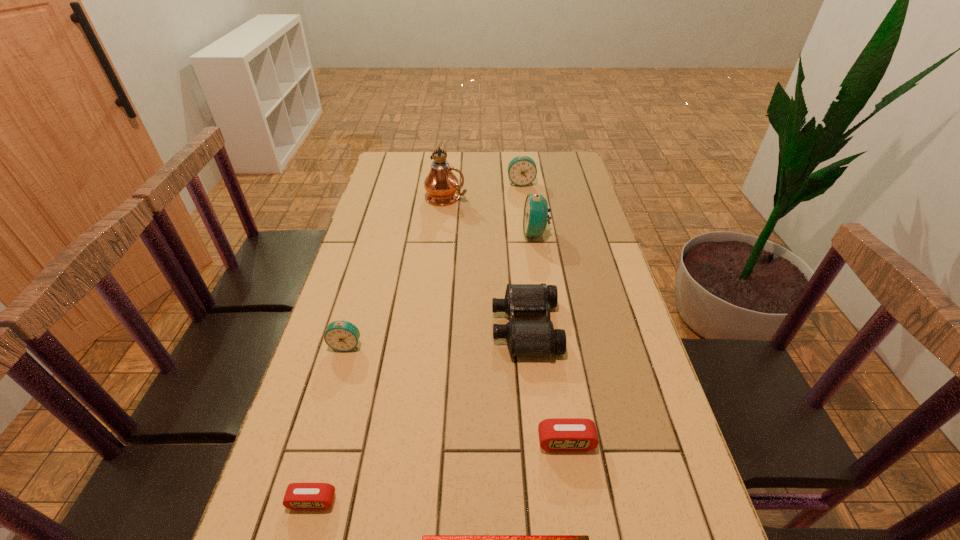
Where is `vacant area that lies between the seventh shortest object and the oil lamp`? This screenshot has width=960, height=540. vacant area that lies between the seventh shortest object and the oil lamp is located at coordinates (491, 215).

The width and height of the screenshot is (960, 540). In order to click on vacant space in between the third shortest alarm clock and the tallest object in this screenshot , I will do `click(396, 271)`.

Where is `free area in between the nearest blue alarm clock and the tallest object`? free area in between the nearest blue alarm clock and the tallest object is located at coordinates (396, 271).

Locate an element on the screen. This screenshot has height=540, width=960. free area in between the leftmost blue alarm clock and the right pink alarm clock is located at coordinates (456, 394).

Identify the location of object that stands as the fourth closest to the second farthest alarm clock. Image resolution: width=960 pixels, height=540 pixels. (340, 335).

Find the location of a particular element. The image size is (960, 540). the third closest object to the sixth farthest object is located at coordinates (299, 496).

At what (x,y) coordinates should I click in order to perform the action: click on the second closest alarm clock to the farthest alarm clock. Please return your answer as a coordinate pair (x, y). This screenshot has width=960, height=540. Looking at the image, I should click on (340, 335).

I want to click on alarm clock that is the nearest to the binoculars, so click(x=557, y=434).

Identify which blue alarm clock is located as the second nearest to the smallest blue alarm clock. Please provide its 2D coordinates. Your answer should be formatted as a tuple, i.e. [(x, y)], where the tuple contains the x and y coordinates of a point satisfying the conditions above.

[(522, 171)]

Identify which blue alarm clock is located as the second nearest to the binoculars. Please provide its 2D coordinates. Your answer should be formatted as a tuple, i.e. [(x, y)], where the tuple contains the x and y coordinates of a point satisfying the conditions above.

[(340, 335)]